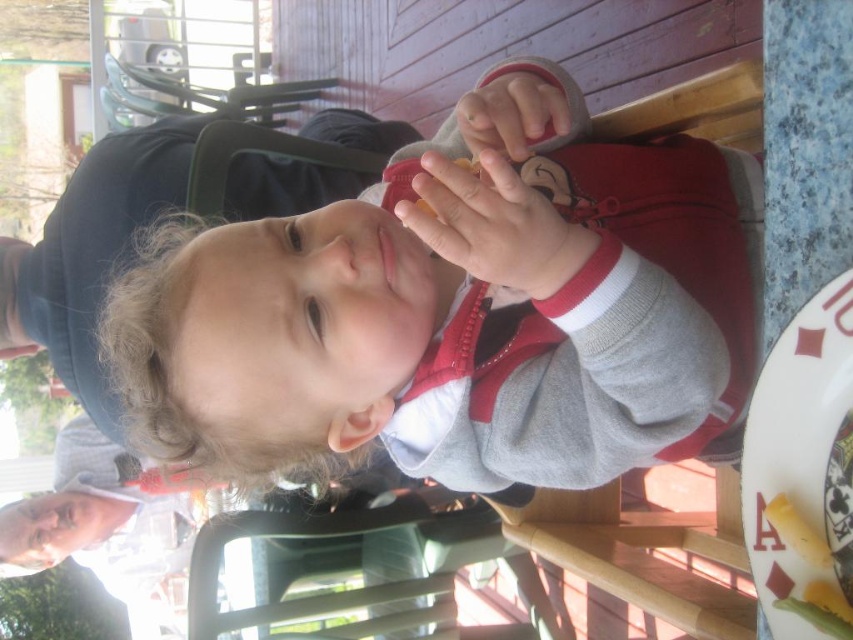
Is point (543, 157) positioned after point (521, 109)?

Yes, point (543, 157) is farther from viewer.

Between point (622, 273) and point (520, 96), which one is positioned in front?

Point (622, 273)

The width and height of the screenshot is (853, 640). I want to click on gray fleece jacket at center, so click(460, 317).

Can you confirm if gray fleece jacket at center is positioned to the left of smooth skin hand at center?

Indeed, gray fleece jacket at center is positioned on the left side of smooth skin hand at center.

In the scene shown: Does gray fleece jacket at center appear under smooth skin hand at center?

Yes, gray fleece jacket at center is below smooth skin hand at center.

Find the location of a particular element. The image size is (853, 640). gray fleece jacket at center is located at coordinates (460, 317).

Image resolution: width=853 pixels, height=640 pixels. Find the location of `gray fleece jacket at center`. gray fleece jacket at center is located at coordinates (460, 317).

Who is more distant from viewer, (793, 513) or (460, 120)?

The point (460, 120) is more distant.

Is white glossy plate at lower right smaller than matte plastic phone at upper center?

Yes, white glossy plate at lower right is smaller than matte plastic phone at upper center.

Where is `white glossy plate at lower right`? The height and width of the screenshot is (640, 853). white glossy plate at lower right is located at coordinates (804, 472).

The width and height of the screenshot is (853, 640). What are the coordinates of `white glossy plate at lower right` in the screenshot? It's located at (804, 472).